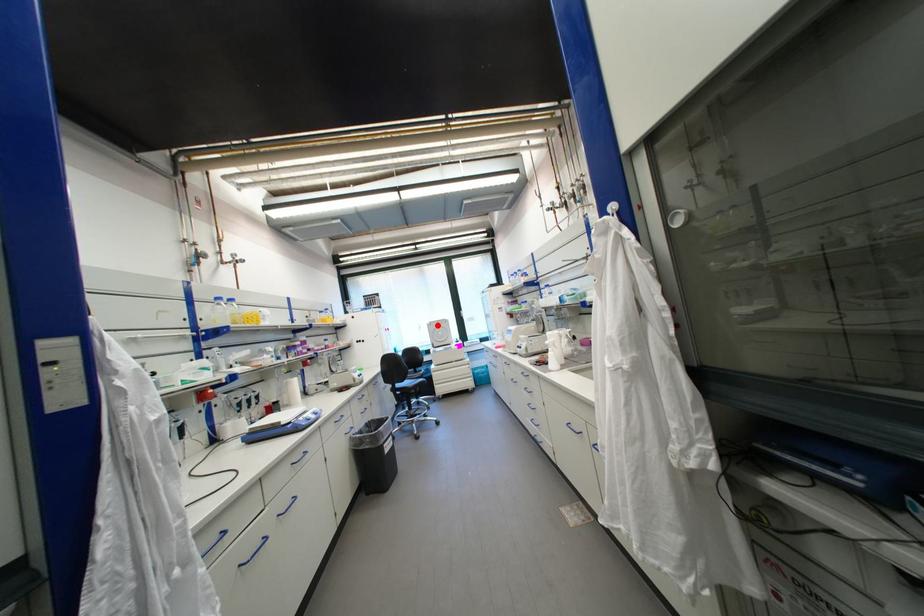
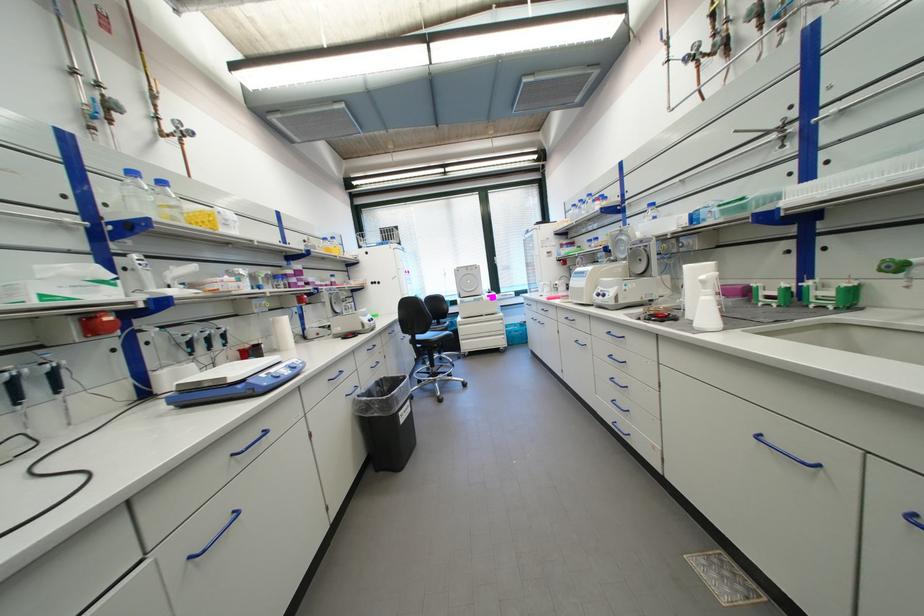
Locate, in the second image, the point that corresponds to the highlighted location in the first image.

(466, 272)